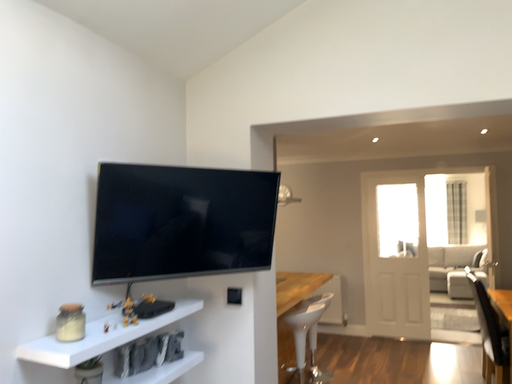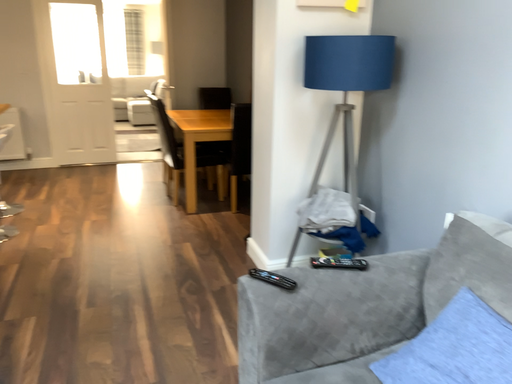
Question: Which way did the camera rotate in the video?

Choices:
 (A) rotated downward
 (B) rotated upward

Answer: (A)